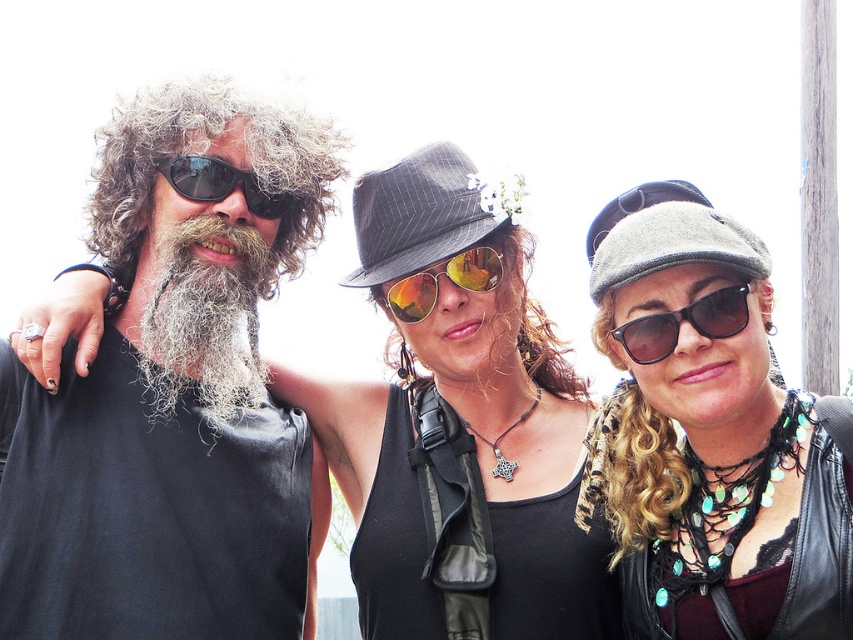
Between matte black tank top at left and white curly beard at left, which one is positioned higher?

white curly beard at left is above.

Does point (257, 520) lie in front of point (213, 280)?

No, it is behind (213, 280).

Does point (24, 496) come closer to viewer compared to point (189, 316)?

Yes, it is in front of point (189, 316).

Identify the location of matte black tank top at left. The width and height of the screenshot is (853, 640). (173, 392).

Looking at this image, can you confirm if black reflective sunglasses at left is taller than gray felt cap at center?

In fact, black reflective sunglasses at left may be shorter than gray felt cap at center.

Is black reflective sunglasses at left positioned in front of gray felt cap at center?

Yes.

Is point (262, 211) more distant than point (608, 225)?

That is False.

I want to click on black reflective sunglasses at left, so click(x=219, y=182).

From the picture: Can you confirm if leather jacket at center is smaller than black matte sunglasses at center?

Incorrect, leather jacket at center is not smaller in size than black matte sunglasses at center.

Does leather jacket at center have a greater width compared to black matte sunglasses at center?

Yes.

The width and height of the screenshot is (853, 640). What do you see at coordinates (708, 435) in the screenshot?
I see `leather jacket at center` at bounding box center [708, 435].

You are a GUI agent. You are given a task and a screenshot of the screen. Output one action in this format:
    pyautogui.click(x=<x>, y=<y>)
    Task: Click on the leather jacket at center
    The image size is (853, 640).
    Given the screenshot: What is the action you would take?
    pyautogui.click(x=708, y=435)